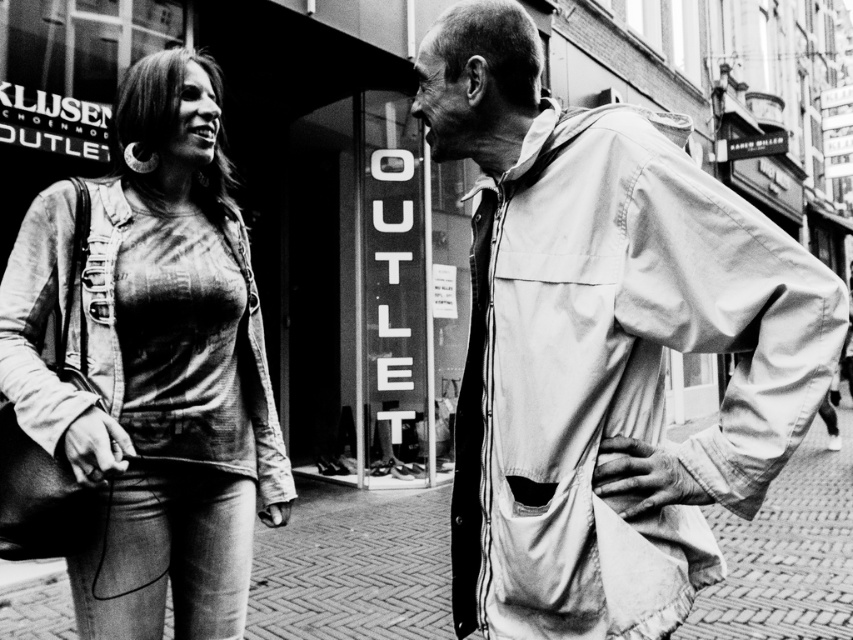
Question: From the image, what is the correct spatial relationship of light beige fabric jacket at right in relation to ripped denim jacket at left?

Choices:
 (A) right
 (B) left

Answer: (A)

Question: Does light beige fabric jacket at right have a smaller size compared to brick pavement at lower center?

Choices:
 (A) yes
 (B) no

Answer: (B)

Question: Which of these objects is positioned farthest from the light beige fabric jacket at right?

Choices:
 (A) ripped denim jacket at left
 (B) brick pavement at lower center

Answer: (B)

Question: Which object appears closest to the camera in this image?

Choices:
 (A) ripped denim jacket at left
 (B) brick pavement at lower center

Answer: (A)

Question: Which of the following is the farthest from the observer?

Choices:
 (A) light beige fabric jacket at right
 (B) ripped denim jacket at left

Answer: (B)

Question: Does light beige fabric jacket at right have a lesser width compared to brick pavement at lower center?

Choices:
 (A) no
 (B) yes

Answer: (B)